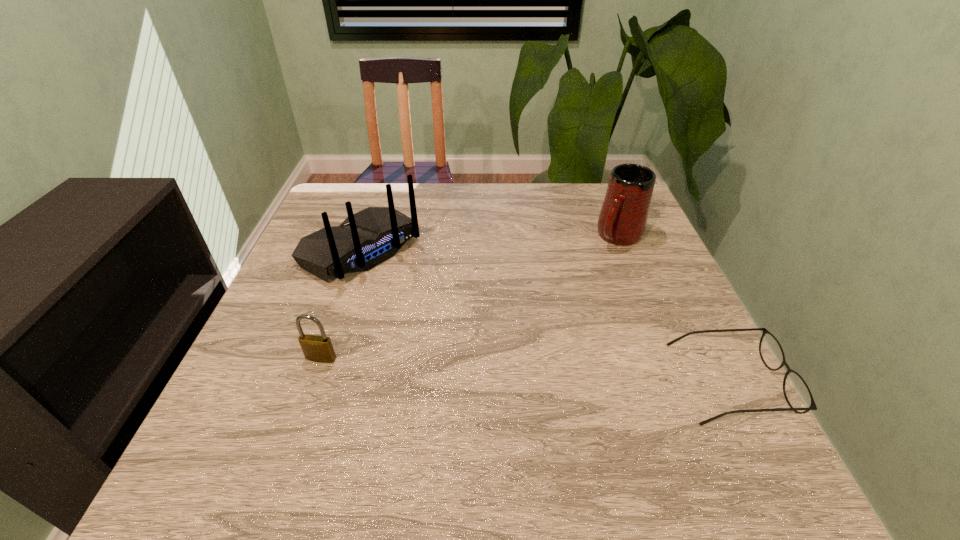
What are the coordinates of `free spot on the desktop that is between the padlock and the spectacles and is positioned on the back of the router` in the screenshot? It's located at (524, 370).

Identify the location of free space on the desktop that is between the padlock and the shortest object and is positioned on the side of the mug with the handle. (495, 368).